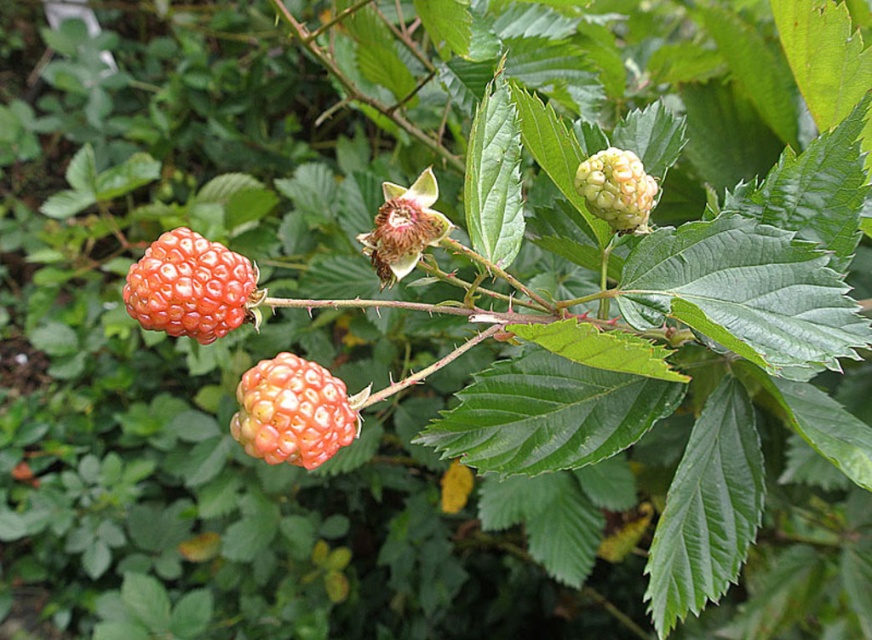
You are a gardener looking at the plant. You notice the ripe red raspberry at center and the matte yellow berry at upper right. Which one is closer to you?

The ripe red raspberry at center is closer because it is in front of the matte yellow berry at upper right.

You are a berry picker trying to determine which raspberry to pick first. Based on their sizes, which one should you pick first between the ripe red raspberry at center and the orange matte berry at center?

The ripe red raspberry at center is bigger than the orange matte berry at center, so you should pick the ripe red raspberry at center first.

You are a gardener who wants to harvest the berries. The orange matte berry at center is ready to pick, but the matte yellow berry at upper right is not yet ripe. To ensure you don not accidentally pick the unripe one, how far apart are the two berries?

The orange matte berry at center and the matte yellow berry at upper right are 18.13 inches apart.